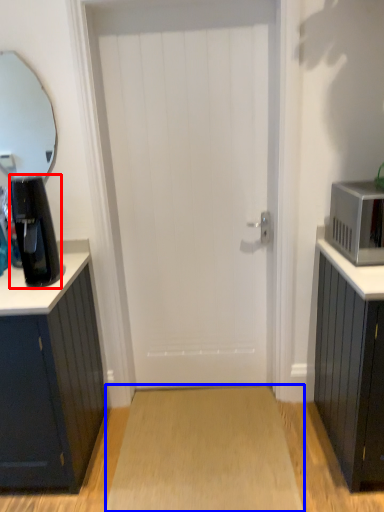
Question: Which object is further to the camera taking this photo, coffee maker (highlighted by a red box) or plain (highlighted by a blue box)?

Choices:
 (A) coffee maker
 (B) plain

Answer: (B)